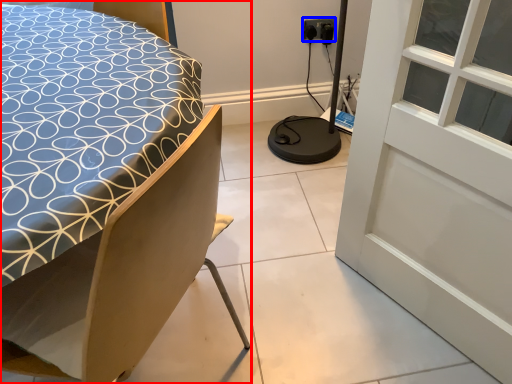
Question: Which object appears closest to the camera in this image, bed (highlighted by a red box) or electric outlet (highlighted by a blue box)?

Choices:
 (A) bed
 (B) electric outlet

Answer: (A)